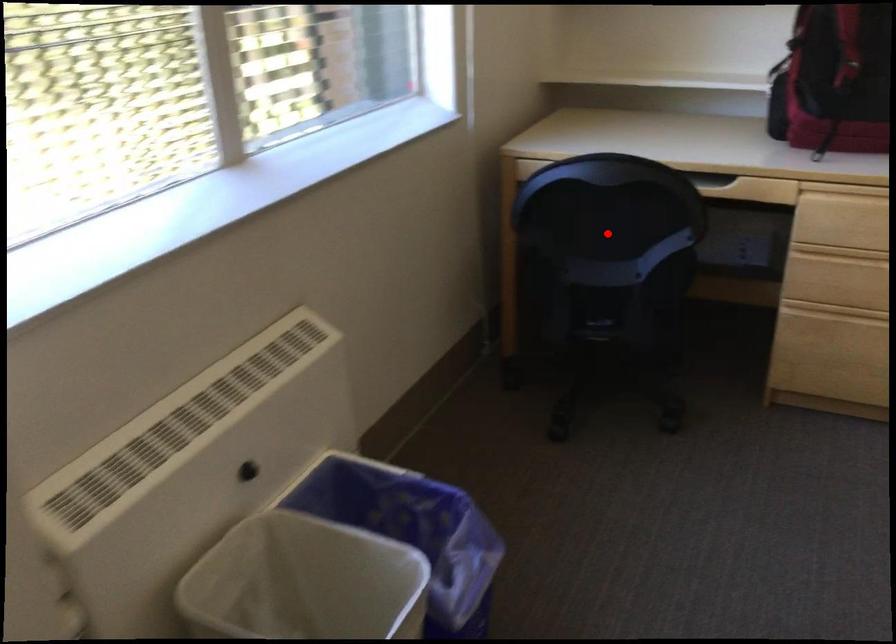
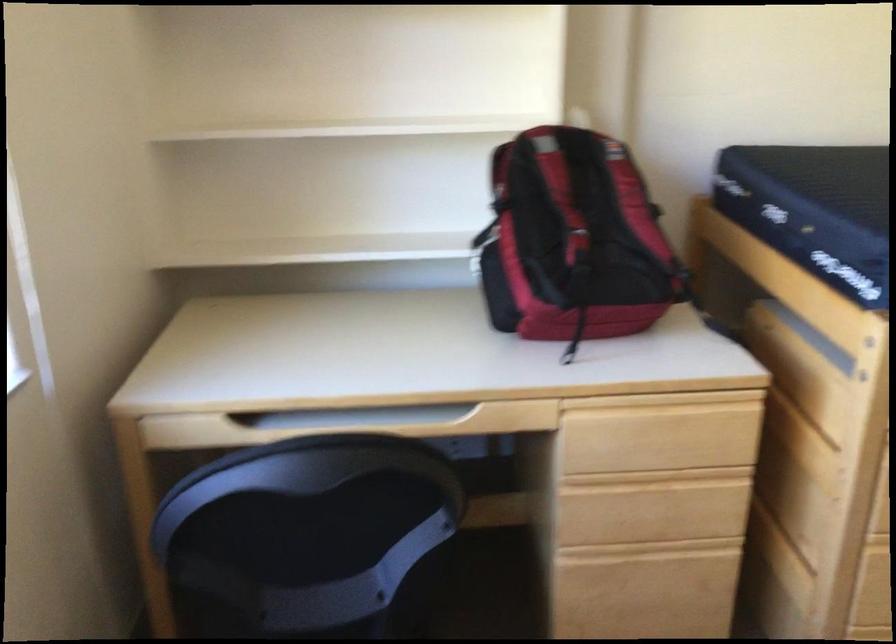
Question: I am providing you with two images of the same scene from different viewpoints. Given a red point in image1, look at the same physical point in image2. Is it:

Choices:
 (A) Closer to the viewpoint
 (B) Farther from the viewpoint

Answer: (A)